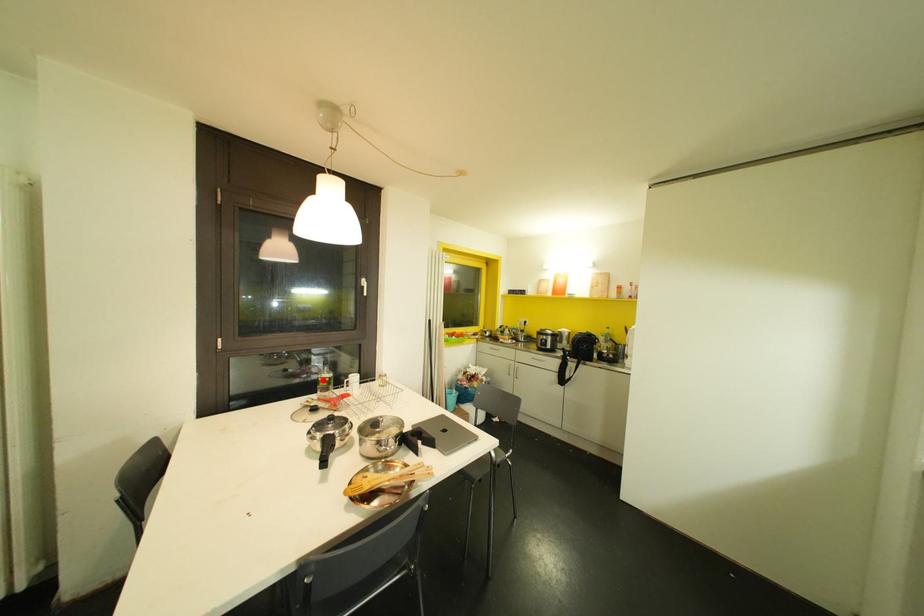
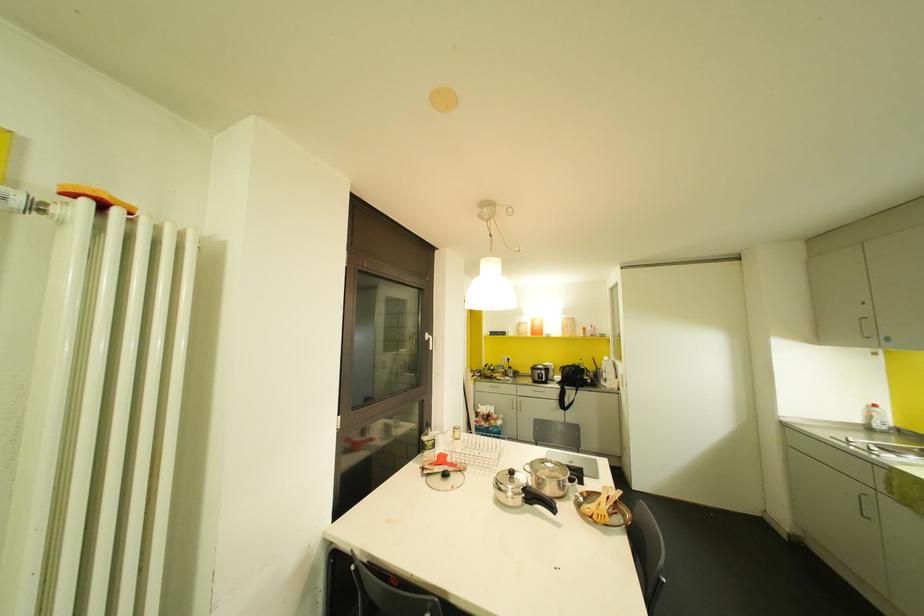
Question: I am providing you with two images of the same scene from different viewpoints. Given a red point in image1, look at the same physical point in image2. Is it:

Choices:
 (A) Closer to the viewpoint
 (B) Farther from the viewpoint

Answer: (B)